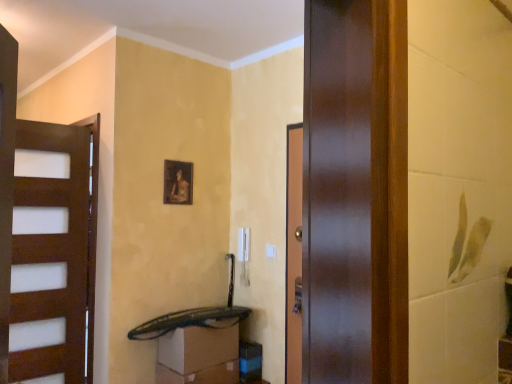
Question: Is matte white drawer at lower center, the 1th drawer ordered from the bottom, beside black plastic drawer at lower center, placed as the 1th drawer when sorted from top to bottom?

Choices:
 (A) no
 (B) yes

Answer: (B)

Question: Would you say black plastic drawer at lower center, placed as the 1th drawer when sorted from top to bottom, is part of matte white drawer at lower center, which appears as the 2th drawer when viewed from the top,'s contents?

Choices:
 (A) no
 (B) yes

Answer: (A)

Question: Would you say matte white drawer at lower center, which appears as the 2th drawer when viewed from the top, is outside black plastic drawer at lower center, placed as the 1th drawer when sorted from top to bottom?

Choices:
 (A) no
 (B) yes

Answer: (B)

Question: Considering the relative sizes of matte white drawer at lower center, which appears as the 2th drawer when viewed from the top, and black plastic drawer at lower center, which is the 2th drawer in bottom-to-top order, in the image provided, is matte white drawer at lower center, which appears as the 2th drawer when viewed from the top, shorter than black plastic drawer at lower center, which is the 2th drawer in bottom-to-top order,?

Choices:
 (A) no
 (B) yes

Answer: (B)

Question: Considering the relative sizes of matte white drawer at lower center, the 1th drawer ordered from the bottom, and black plastic drawer at lower center, placed as the 1th drawer when sorted from top to bottom, in the image provided, is matte white drawer at lower center, the 1th drawer ordered from the bottom, thinner than black plastic drawer at lower center, placed as the 1th drawer when sorted from top to bottom,?

Choices:
 (A) no
 (B) yes

Answer: (A)

Question: From the image's perspective, is black plastic drawer at lower center, which is the 2th drawer in bottom-to-top order, above or below matte white drawer at lower center, the 1th drawer ordered from the bottom?

Choices:
 (A) below
 (B) above

Answer: (B)

Question: In the image, is black plastic drawer at lower center, which is the 2th drawer in bottom-to-top order, on the left side or the right side of matte white drawer at lower center, the 1th drawer ordered from the bottom?

Choices:
 (A) left
 (B) right

Answer: (B)

Question: From their relative heights in the image, would you say black plastic drawer at lower center, placed as the 1th drawer when sorted from top to bottom, is taller or shorter than matte white drawer at lower center, the 1th drawer ordered from the bottom?

Choices:
 (A) tall
 (B) short

Answer: (A)

Question: Does point (185, 339) appear closer or farther from the camera than point (176, 380)?

Choices:
 (A) farther
 (B) closer

Answer: (B)

Question: Is matte wooden picture frame at center situated inside black plastic drawer at lower center, which is the 2th drawer in bottom-to-top order, or outside?

Choices:
 (A) outside
 (B) inside

Answer: (A)

Question: From their relative heights in the image, would you say matte wooden picture frame at center is taller or shorter than black plastic drawer at lower center, placed as the 1th drawer when sorted from top to bottom?

Choices:
 (A) tall
 (B) short

Answer: (A)

Question: From a real-world perspective, is matte wooden picture frame at center positioned above or below black plastic drawer at lower center, which is the 2th drawer in bottom-to-top order?

Choices:
 (A) above
 (B) below

Answer: (A)

Question: From the image's perspective, is matte wooden picture frame at center located above or below black plastic drawer at lower center, which is the 2th drawer in bottom-to-top order?

Choices:
 (A) below
 (B) above

Answer: (B)

Question: In the image, is black plastic drawer at lower center, which is the 2th drawer in bottom-to-top order, on the left side or the right side of matte wooden picture frame at center?

Choices:
 (A) right
 (B) left

Answer: (A)

Question: Choose the correct answer: Is black plastic drawer at lower center, which is the 2th drawer in bottom-to-top order, inside matte wooden picture frame at center or outside it?

Choices:
 (A) inside
 (B) outside

Answer: (B)